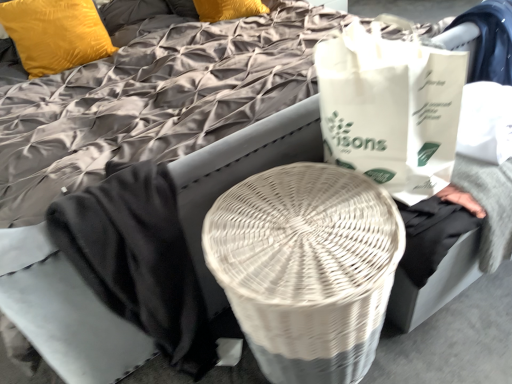
Question: Choose the correct answer: Is white paper grocery bag at right inside velvet yellow pillow at upper left or outside it?

Choices:
 (A) inside
 (B) outside

Answer: (B)

Question: Considering their positions, is white paper grocery bag at right located in front of or behind velvet yellow pillow at upper left?

Choices:
 (A) front
 (B) behind

Answer: (A)

Question: Estimate the real-world distances between objects in this image. Which object is closer to the velvet yellow pillow at upper left?

Choices:
 (A) white paper grocery bag at right
 (B) white wicker basket at center

Answer: (A)

Question: Based on their relative distances, which object is nearer to the white paper grocery bag at right?

Choices:
 (A) white wicker basket at center
 (B) velvet yellow pillow at upper left

Answer: (A)